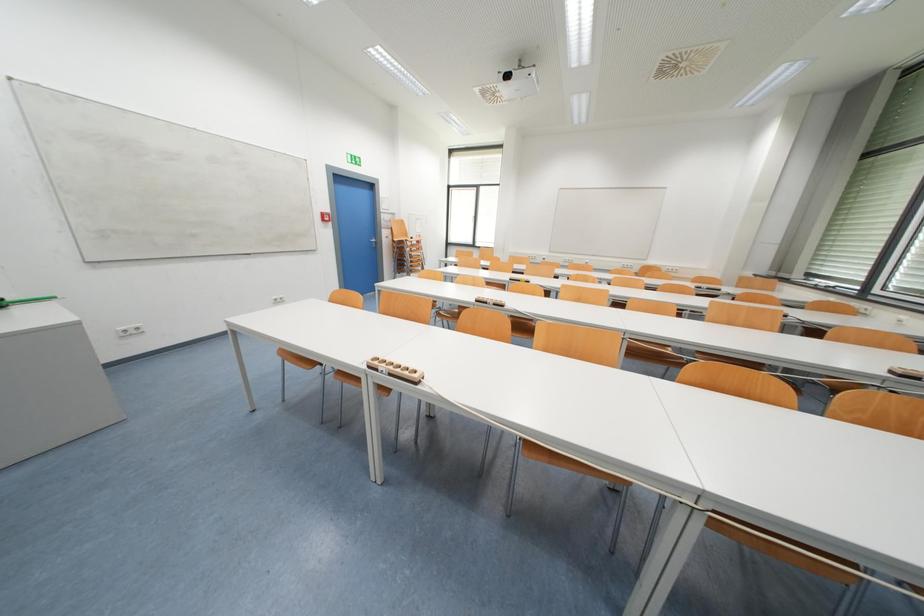
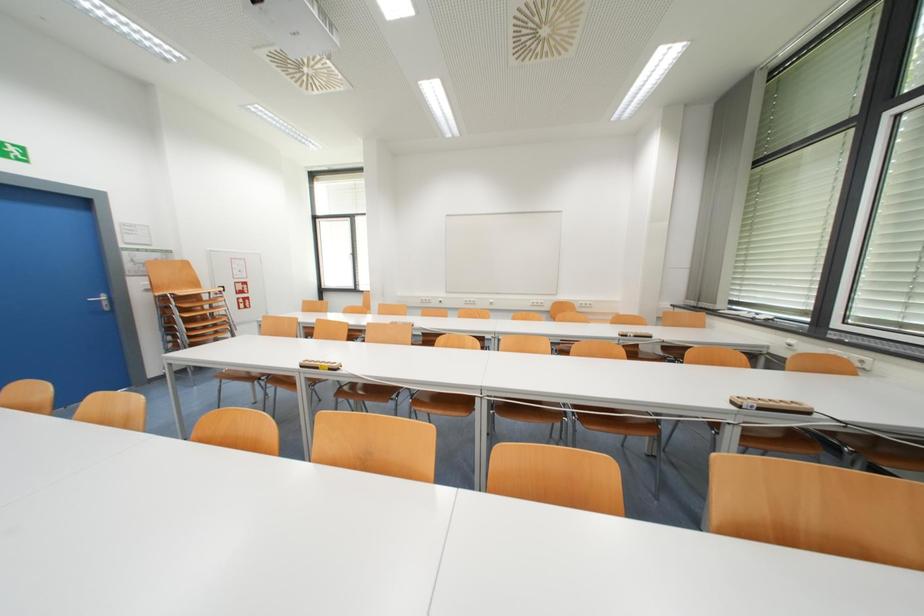
Which direction would the cameraman need to move to produce the second image?

The cameraman walked toward right, forward.